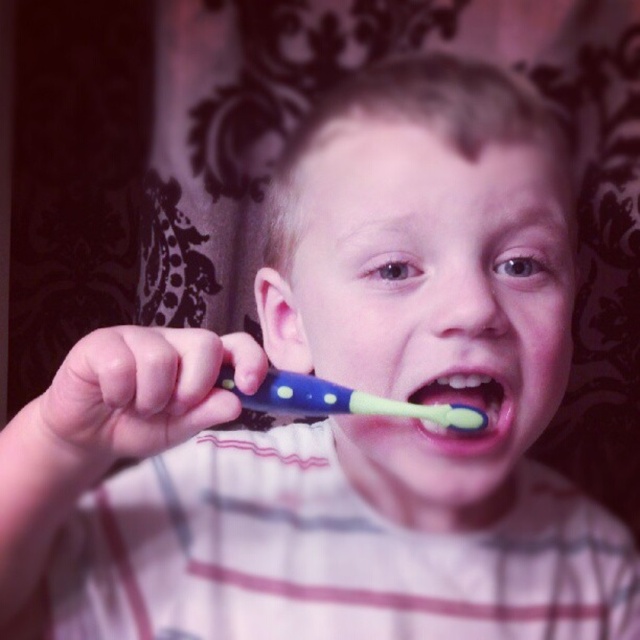
You are a photographer trying to capture a closeup shot of the child brushing their teeth. You have two points marked in the image for focus. The first point is at coordinate point [300,404] and the second is at point [483,385]. Which point should you choose to ensure the subject is in focus and appears closer to the camera?

Point [300,404] is closer to the viewer than point [483,385], so you should choose point [300,404] to ensure the subject is in focus and appears closer to the camera.

You are a dentist examining the child brushing their teeth. You notice both the blue rubber toothbrush at center and the green rubber toothbrush at center. Which toothbrush is closer to you?

The blue rubber toothbrush at center is closer because it is in front of the green rubber toothbrush at center.

Looking at this image, you are a parent observing your child brushing teeth. You see two toothbrushes at the center of the scene, the blue rubber toothbrush at center and the green rubber toothbrush at center. Which one has a wider grip for easier handling?

The blue rubber toothbrush at center has a larger width than the green rubber toothbrush at center, making it easier to handle.